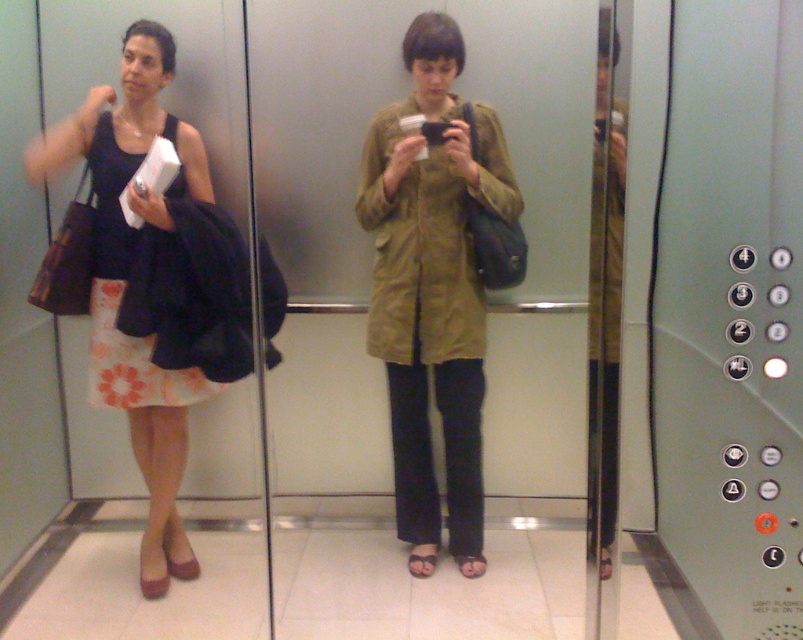
You are designing a storage space for an elevator that needs to accommodate both the green matte coat at center and the matte olive green jacket at center. Since the elevator has limited space, you need to know which item requires more storage space. Based on the image, which item should be placed first to optimize space?

The green matte coat at center is bigger than the matte olive green jacket at center, so it should be placed first to optimize space.

You are designing a new elevator interior and want to ensure that the green matte coat at center and the matte black dress at left can be seen clearly in the mirrored walls. Based on their positions, which item is more likely to be fully visible in the reflections?

The green matte coat at center is positioned over the matte black dress at left, so the green matte coat at center would be more likely to be fully visible in the mirrored walls as it is in a central position.